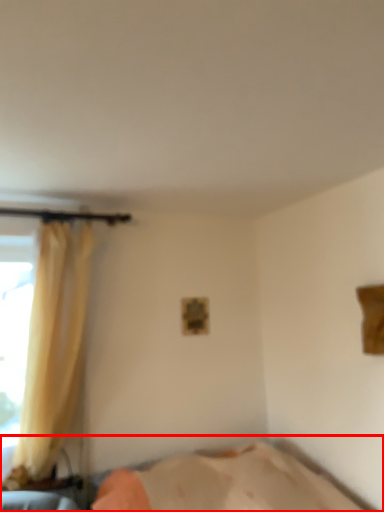
Question: Observing the image, what is the correct spatial positioning of bed (annotated by the red box) in reference to curtain?

Choices:
 (A) left
 (B) right

Answer: (B)